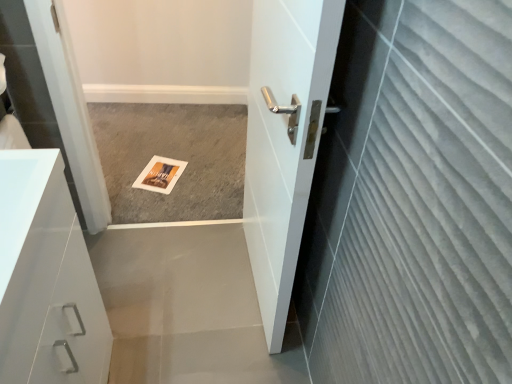
Question: Is white glossy cabinet at left touching gray carpet at center?

Choices:
 (A) no
 (B) yes

Answer: (A)

Question: Does white glossy cabinet at left have a lesser width compared to gray carpet at center?

Choices:
 (A) yes
 (B) no

Answer: (A)

Question: Considering the relative sizes of white glossy cabinet at left and gray carpet at center in the image provided, is white glossy cabinet at left shorter than gray carpet at center?

Choices:
 (A) no
 (B) yes

Answer: (A)

Question: Does white glossy cabinet at left come behind gray carpet at center?

Choices:
 (A) yes
 (B) no

Answer: (B)

Question: Does white glossy cabinet at left appear on the right side of gray carpet at center?

Choices:
 (A) no
 (B) yes

Answer: (A)

Question: Is white glossy cabinet at left smaller than gray carpet at center?

Choices:
 (A) no
 (B) yes

Answer: (A)

Question: From a real-world perspective, is gray carpet at center located beneath white glossy door at center?

Choices:
 (A) yes
 (B) no

Answer: (A)

Question: From the image's perspective, is gray carpet at center above white glossy door at center?

Choices:
 (A) no
 (B) yes

Answer: (B)

Question: Is gray carpet at center not near white glossy door at center?

Choices:
 (A) yes
 (B) no

Answer: (B)

Question: Can you confirm if gray carpet at center is positioned to the right of white glossy door at center?

Choices:
 (A) yes
 (B) no

Answer: (B)

Question: Is gray carpet at center further to camera compared to white glossy door at center?

Choices:
 (A) yes
 (B) no

Answer: (A)

Question: Does gray carpet at center lie in front of white glossy door at center?

Choices:
 (A) no
 (B) yes

Answer: (A)

Question: Does white glossy cabinet at left have a greater height compared to white glossy door at center?

Choices:
 (A) yes
 (B) no

Answer: (B)